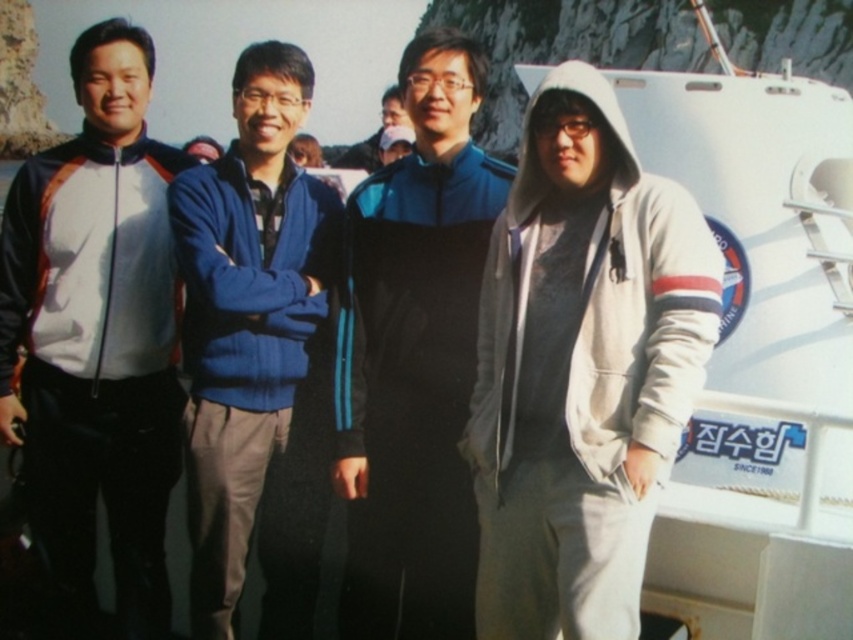
What do you see at coordinates (247, 314) in the screenshot? The width and height of the screenshot is (853, 640). I see `blue fleece jacket at center` at bounding box center [247, 314].

Between blue fleece jacket at center and matte black jacket at center, which one has more height?

matte black jacket at center

Who is more distant from viewer, (204, 374) or (387, 92)?

The point (387, 92) is behind.

This screenshot has height=640, width=853. I want to click on blue fleece jacket at center, so click(247, 314).

Where is `matte black jacket at left`? matte black jacket at left is located at coordinates (96, 337).

Consider the image. Is matte black jacket at left smaller than blue fleece jacket at center?

Actually, matte black jacket at left might be larger than blue fleece jacket at center.

The image size is (853, 640). Find the location of `matte black jacket at left`. matte black jacket at left is located at coordinates (96, 337).

Who is taller, blue/black track suit at center or matte black jacket at center?

With more height is matte black jacket at center.

Does blue/black track suit at center have a lesser height compared to matte black jacket at center?

Indeed, blue/black track suit at center has a lesser height compared to matte black jacket at center.

Find the location of a particular element. This screenshot has width=853, height=640. blue/black track suit at center is located at coordinates (415, 355).

This screenshot has width=853, height=640. What are the coordinates of `blue/black track suit at center` in the screenshot? It's located at (415, 355).